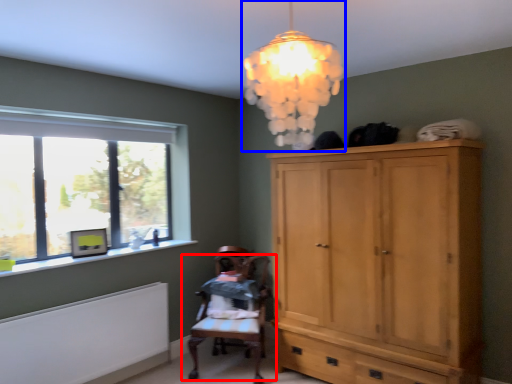
Question: Which object appears closest to the camera in this image, chair (highlighted by a red box) or lamp (highlighted by a blue box)?

Choices:
 (A) chair
 (B) lamp

Answer: (B)